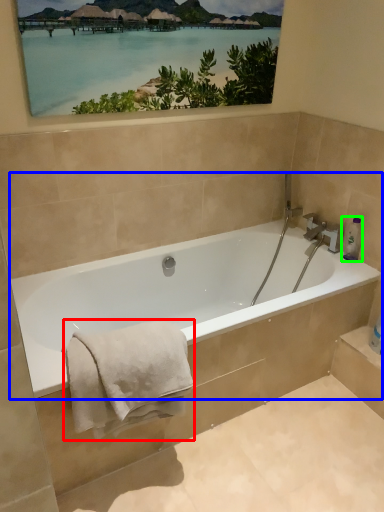
Question: Based on their relative distances, which object is farther from bath towel (highlighted by a red box)? Choose from bathtub (highlighted by a blue box) and toiletry (highlighted by a green box).

Choices:
 (A) bathtub
 (B) toiletry

Answer: (B)